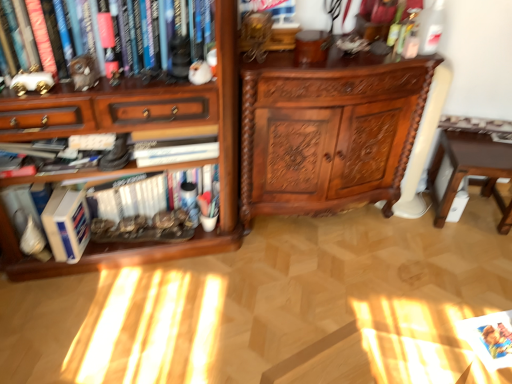
Find the location of a particular element. blank space to the left of brown wooden table at lower right is located at coordinates (408, 229).